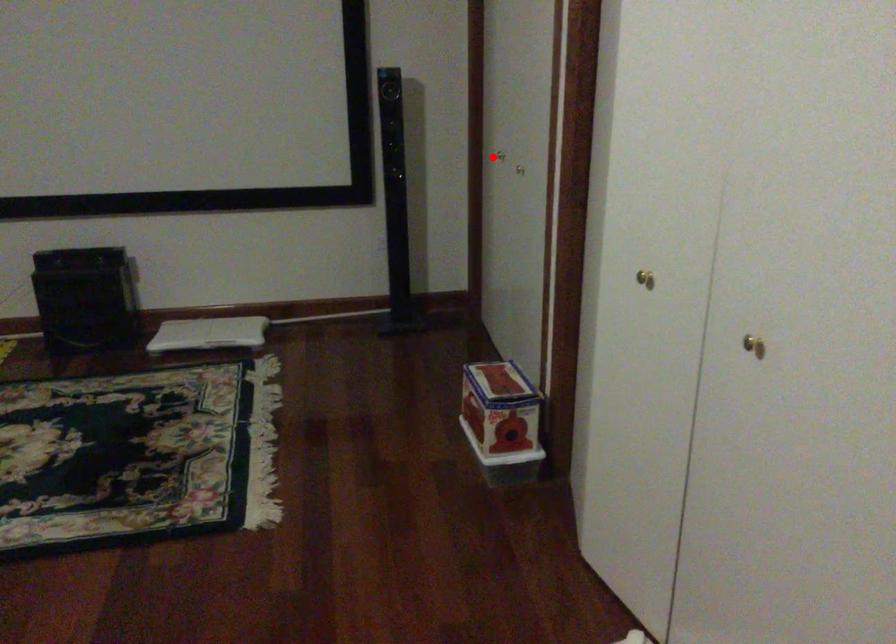
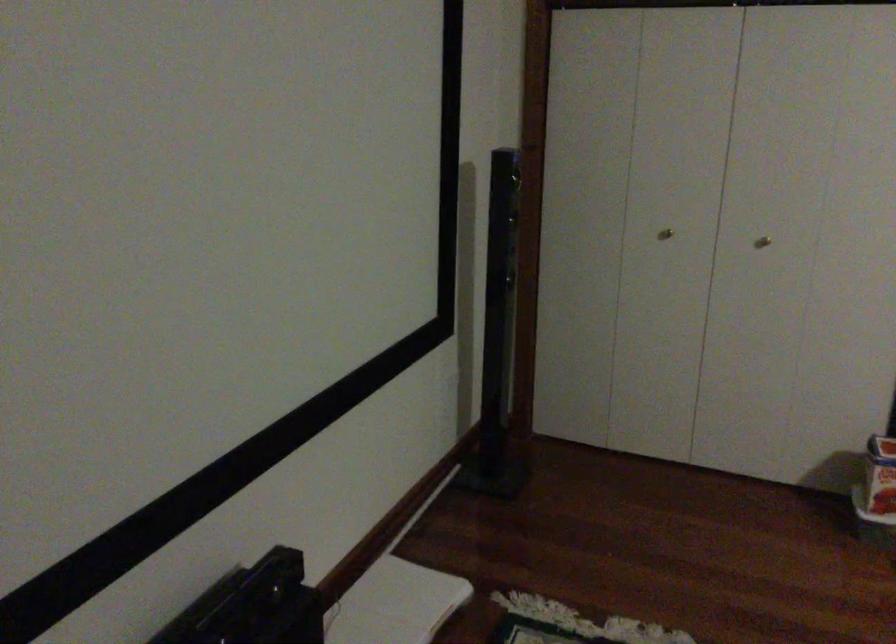
Where in the second image is the point corresponding to the highlighted location from the first image?

(665, 234)